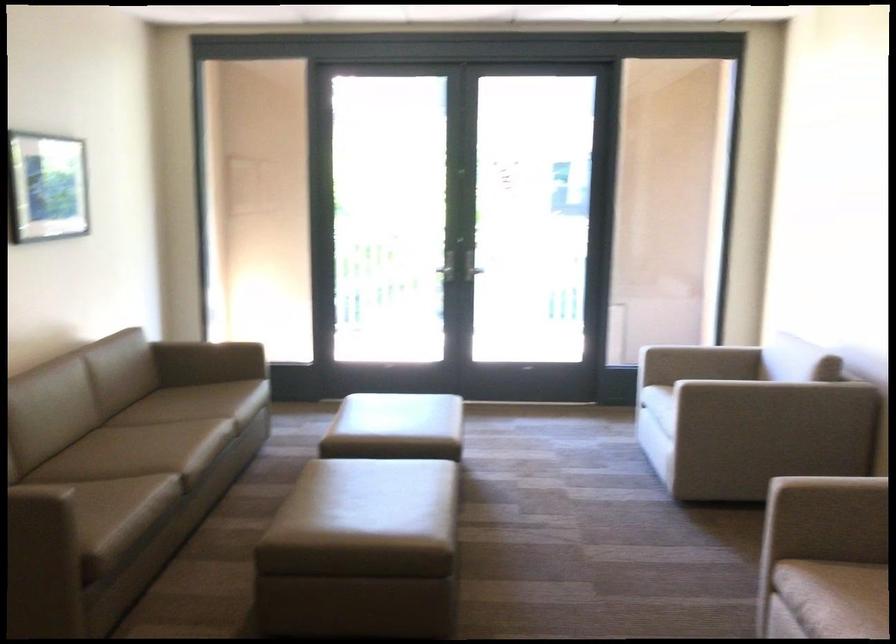
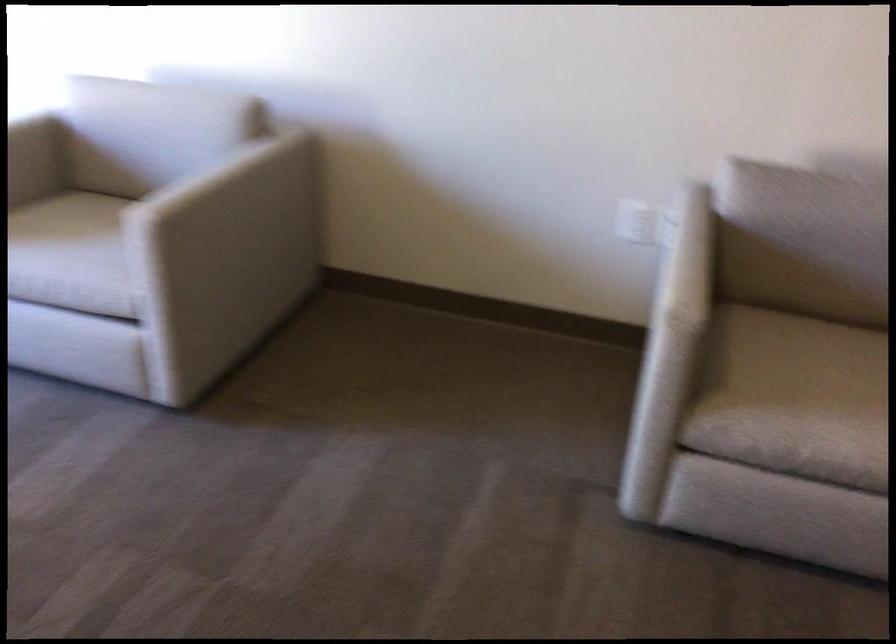
Locate, in the second image, the point that corresponds to (727,352) in the first image.

(28, 124)